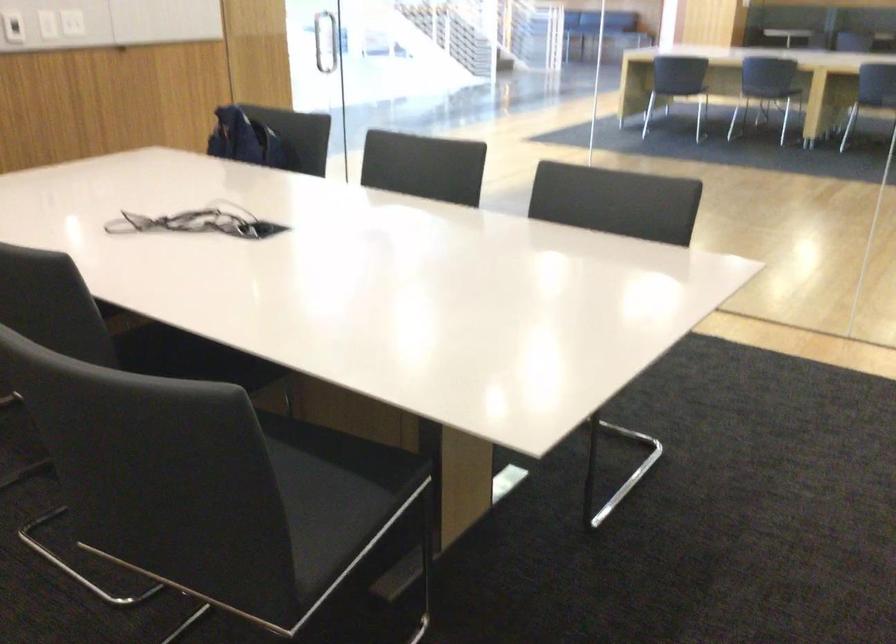
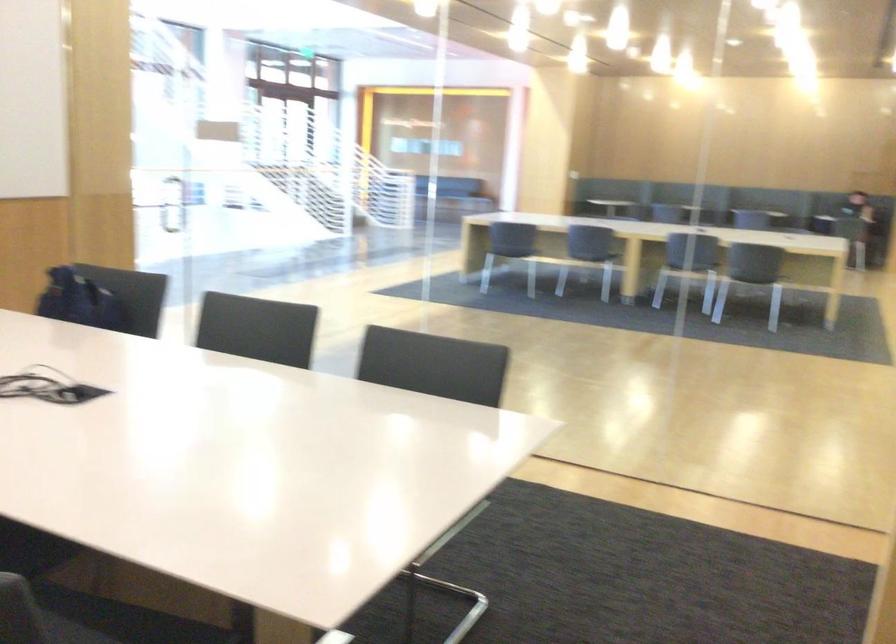
Find the pixel in the second image that matches point 286,438 in the first image.

(88, 618)